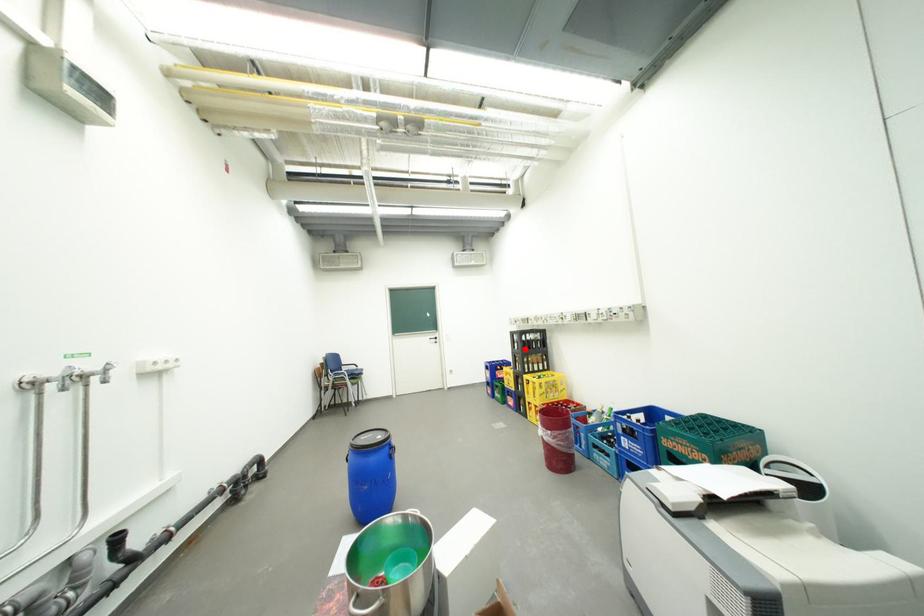
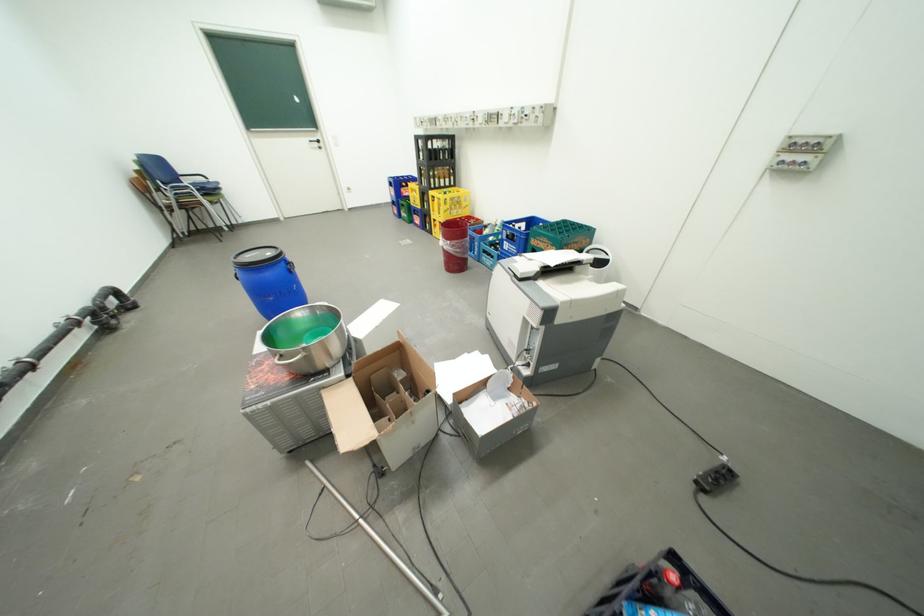
Question: I am providing you with two images of the same scene from different viewpoints. A red point is shown in image1. For the corresponding object point in image2, is it positioned nearer or farther from the camera?

Choices:
 (A) Nearer
 (B) Farther

Answer: (A)